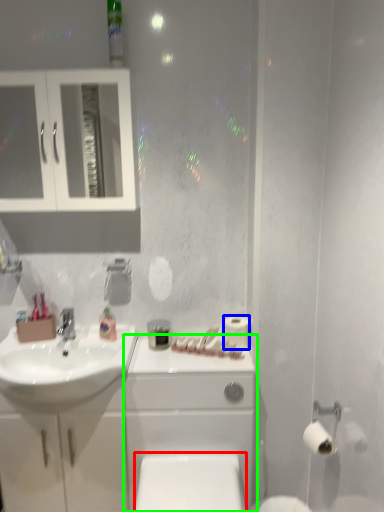
Question: Which object is the closest to the toilet bowl (highlighted by a red box)? Choose among these: toilet paper (highlighted by a blue box) or porcelain (highlighted by a green box).

Choices:
 (A) toilet paper
 (B) porcelain

Answer: (B)